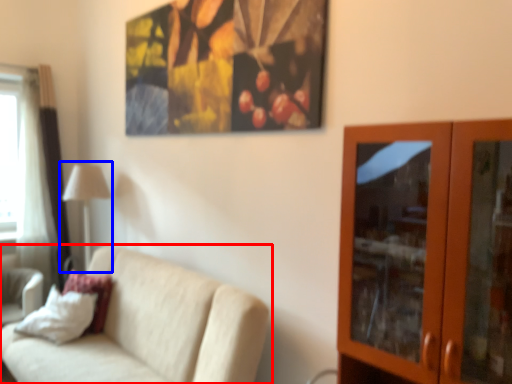
Question: Which object appears closest to the camera in this image, studio couch (highlighted by a red box) or table lamp (highlighted by a blue box)?

Choices:
 (A) studio couch
 (B) table lamp

Answer: (A)